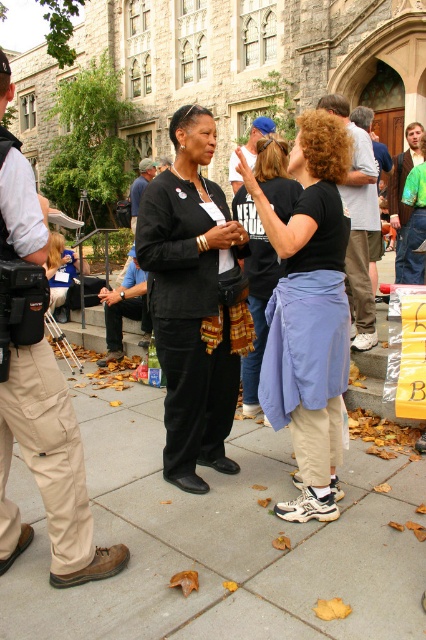
Is black fabric shirt at center closer to camera compared to dark blue jeans at center?

Yes, black fabric shirt at center is closer to the viewer.

Who is taller, black fabric shirt at center or dark blue jeans at center?

Standing taller between the two is black fabric shirt at center.

Where is `black fabric shirt at center`? This screenshot has width=426, height=640. black fabric shirt at center is located at coordinates (308, 314).

Who is more distant from viewer, (69, 406) or (233, 152)?

The point (233, 152) is more distant.

Is khaki cargo pants at left wider than blue fabric cap at center?

Incorrect, khaki cargo pants at left's width does not surpass blue fabric cap at center's.

Find the location of `khaki cargo pants at left`. khaki cargo pants at left is located at coordinates (39, 392).

Which is in front, point (351, 342) or point (233, 154)?

Point (351, 342) is in front.

The image size is (426, 640). Find the location of `dark gray pants at center`. dark gray pants at center is located at coordinates (357, 225).

Where is `dark gray pants at center`? dark gray pants at center is located at coordinates [x=357, y=225].